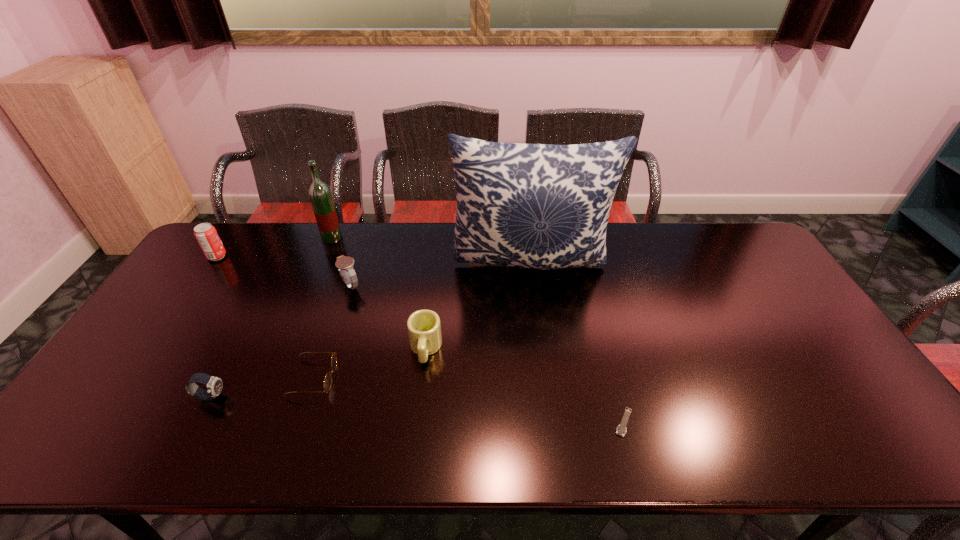
Identify the location of sunglasses. (327, 384).

The width and height of the screenshot is (960, 540). Find the location of `the shortest object`. the shortest object is located at coordinates (621, 430).

Locate an element on the screen. the nearest watch is located at coordinates (621, 430).

This screenshot has height=540, width=960. In order to click on blank area located 0.060m on the front surface of the cushion in this screenshot , I will do `click(536, 307)`.

The image size is (960, 540). Find the location of `free point located 0.350m on the right of the sixth object from right to left`. free point located 0.350m on the right of the sixth object from right to left is located at coordinates (441, 238).

The height and width of the screenshot is (540, 960). Find the location of `vacant region located on the right of the sixth shortest object`. vacant region located on the right of the sixth shortest object is located at coordinates (318, 256).

Locate an element on the screen. vacant space situated 0.190m on the left of the second watch from left to right is located at coordinates (277, 286).

At what (x,y) coordinates should I click in order to perform the action: click on vacant space located with the handle on the side of the sixth object from left to right. Please return your answer as a coordinate pair (x, y). This screenshot has height=540, width=960. Looking at the image, I should click on (418, 416).

Image resolution: width=960 pixels, height=540 pixels. I want to click on blank space located on the face of the second nearest watch, so click(252, 396).

Locate an element on the screen. blank area located 0.330m on the lenses of the sunglasses is located at coordinates (464, 378).